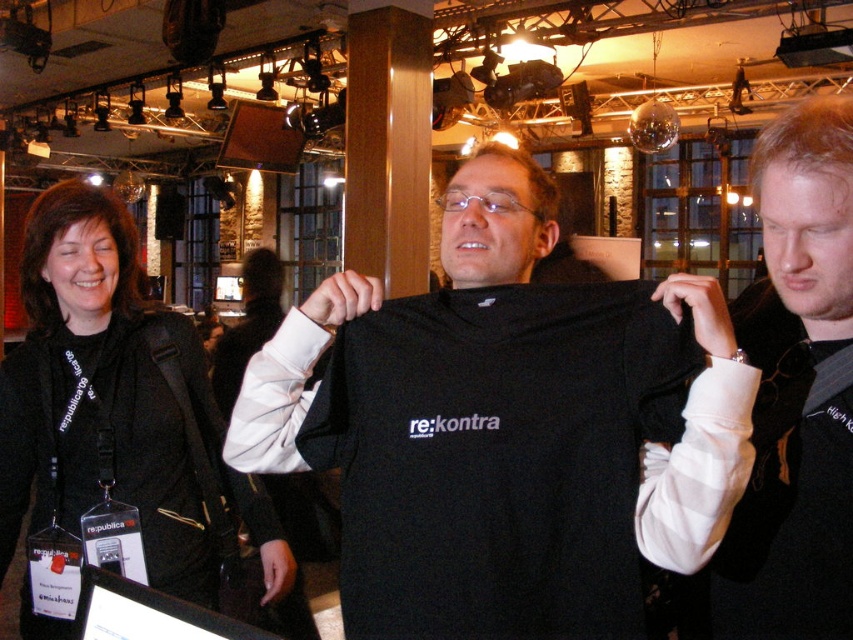
Can you confirm if black fabric t-shirt at center is shorter than black fabric shirt at center?

Yes.

Where is `black fabric t-shirt at center`? black fabric t-shirt at center is located at coordinates (502, 432).

Does point (608, 524) lie behind point (811, 616)?

That is True.

Where is `black fabric t-shirt at center`? The image size is (853, 640). black fabric t-shirt at center is located at coordinates (502, 432).

Does point (206, 499) lie in front of point (764, 625)?

No, it is not.

Does black fabric jacket at upper left have a greater width compared to black fabric shirt at center?

Correct, the width of black fabric jacket at upper left exceeds that of black fabric shirt at center.

Measure the distance between point (99, 326) and camera.

A distance of 6.18 feet exists between point (99, 326) and camera.

The image size is (853, 640). I want to click on black fabric jacket at upper left, so click(x=117, y=406).

In the scene shown: Can you confirm if black fabric t-shirt at center is positioned to the right of black fabric jacket at upper left?

Correct, you'll find black fabric t-shirt at center to the right of black fabric jacket at upper left.

Does black fabric t-shirt at center have a lesser width compared to black fabric jacket at upper left?

No.

This screenshot has height=640, width=853. What do you see at coordinates (502, 432) in the screenshot? I see `black fabric t-shirt at center` at bounding box center [502, 432].

At what (x,y) coordinates should I click in order to perform the action: click on black fabric t-shirt at center. Please return your answer as a coordinate pair (x, y). Looking at the image, I should click on (502, 432).